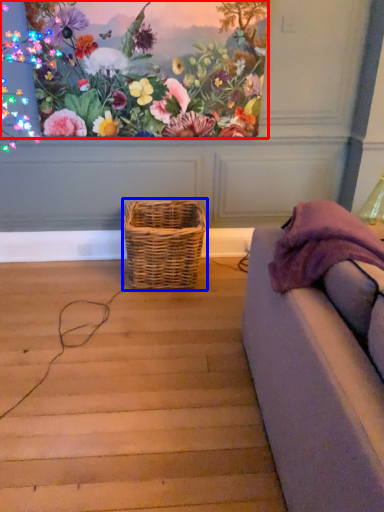
Question: Among these objects, which one is farthest to the camera, flower (highlighted by a red box) or picnic basket (highlighted by a blue box)?

Choices:
 (A) flower
 (B) picnic basket

Answer: (B)